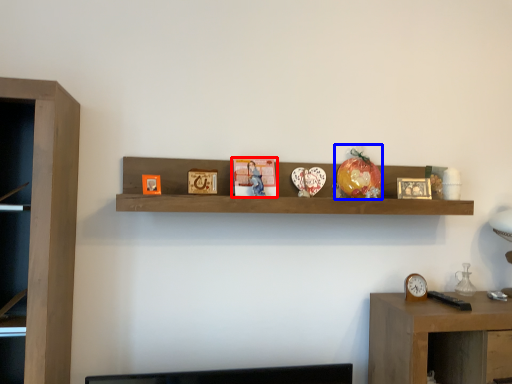
Question: Which object appears closest to the camera in this image, book (highlighted by a red box) or toy (highlighted by a blue box)?

Choices:
 (A) book
 (B) toy

Answer: (A)